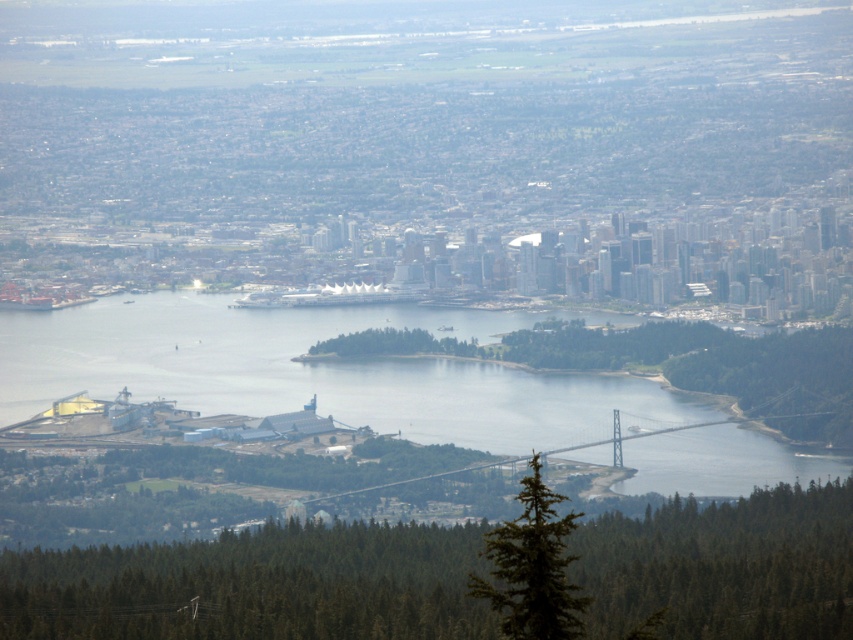
Does green textured tree at lower center have a smaller size compared to green textured tree at lower right?

Actually, green textured tree at lower center might be larger than green textured tree at lower right.

Is green textured tree at lower center below green textured tree at lower right?

Yes, green textured tree at lower center is below green textured tree at lower right.

Where is `green textured tree at lower center`? The width and height of the screenshot is (853, 640). green textured tree at lower center is located at coordinates (254, 586).

At what (x,y) coordinates should I click in order to perform the action: click on green textured tree at lower center. Please return your answer as a coordinate pair (x, y). The image size is (853, 640). Looking at the image, I should click on (254, 586).

Is green textured tree at lower center shorter than clear water at lower center?

Correct, green textured tree at lower center is not as tall as clear water at lower center.

Which is in front, point (296, 604) or point (662, 460)?

Point (296, 604) is in front.

What do you see at coordinates (254, 586) in the screenshot? The width and height of the screenshot is (853, 640). I see `green textured tree at lower center` at bounding box center [254, 586].

At what (x,y) coordinates should I click in order to perform the action: click on green textured tree at lower center. Please return your answer as a coordinate pair (x, y). Looking at the image, I should click on (254, 586).

Does clear water at lower center have a smaller size compared to green textured tree at lower right?

No, clear water at lower center is not smaller than green textured tree at lower right.

Does clear water at lower center have a larger size compared to green textured tree at lower right?

Yes, clear water at lower center is bigger than green textured tree at lower right.

Locate an element on the screen. The height and width of the screenshot is (640, 853). clear water at lower center is located at coordinates (315, 371).

Where is `clear water at lower center`? clear water at lower center is located at coordinates (315, 371).